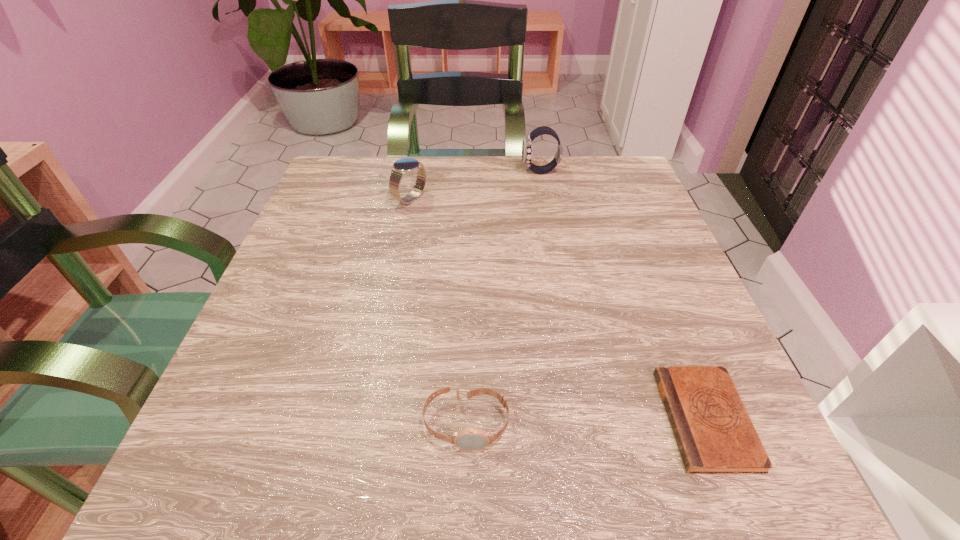
Image resolution: width=960 pixels, height=540 pixels. What are the coordinates of `blank area at the far edge` in the screenshot? It's located at (435, 176).

Identify the location of vacant space at the left edge of the desktop. tap(261, 380).

In the image, there is a desktop. Identify the location of vacant space at the right edge. This screenshot has width=960, height=540. (x=643, y=357).

Where is `vacant space at the far right corner of the desktop`? vacant space at the far right corner of the desktop is located at coordinates (582, 187).

The width and height of the screenshot is (960, 540). I want to click on vacant space at the near right corner of the desktop, so click(739, 494).

Find the location of `free space between the third tallest object and the rightmost watch`. free space between the third tallest object and the rightmost watch is located at coordinates (503, 298).

Identify the location of vacant region between the third tallest object and the tallest object. (503, 298).

Find the location of `free space between the farthest watch and the diary`. free space between the farthest watch and the diary is located at coordinates (623, 295).

Locate an element on the screen. This screenshot has height=540, width=960. free space between the shortest object and the second tallest object is located at coordinates (558, 309).

Find the location of a particular element. empty location between the third shortest object and the diary is located at coordinates (558, 309).